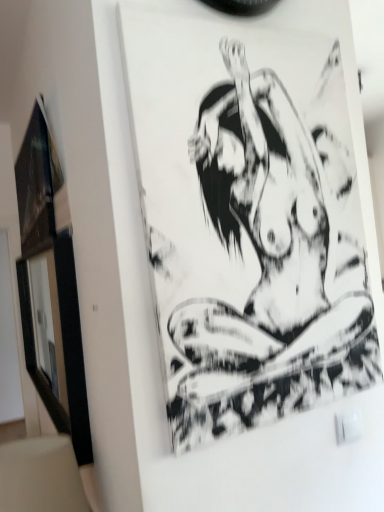
In order to click on black ink drawing at center in this screenshot , I will do `click(266, 220)`.

This screenshot has width=384, height=512. What do you see at coordinates (266, 220) in the screenshot?
I see `black ink drawing at center` at bounding box center [266, 220].

Describe the element at coordinates (37, 183) in the screenshot. I see `matte black picture frame at left` at that location.

You are a GUI agent. You are given a task and a screenshot of the screen. Output one action in this format:
    pyautogui.click(x=<x>, y=<y>)
    Task: Click on the matte black picture frame at left
    This screenshot has width=384, height=512.
    Given the screenshot: What is the action you would take?
    pyautogui.click(x=37, y=183)

I want to click on black ink drawing at center, so click(266, 220).

Does matte black picture frame at left appear on the right side of black ink drawing at center?

In fact, matte black picture frame at left is to the left of black ink drawing at center.

From the picture: Considering the positions of objects matte black picture frame at left and black ink drawing at center in the image provided, who is behind, matte black picture frame at left or black ink drawing at center?

matte black picture frame at left is behind.

Is point (33, 146) positioned in front of point (304, 298)?

No, (33, 146) is further to viewer.

From the image's perspective, is matte black picture frame at left on top of black ink drawing at center?

Yes, from the image's perspective, matte black picture frame at left is over black ink drawing at center.

From a real-world perspective, who is located lower, matte black picture frame at left or black ink drawing at center?

black ink drawing at center.

Between matte black picture frame at left and black ink drawing at center, which one has smaller width?

With smaller width is black ink drawing at center.

Considering the sizes of objects matte black picture frame at left and black ink drawing at center in the image provided, who is taller, matte black picture frame at left or black ink drawing at center?

With more height is black ink drawing at center.

Does matte black picture frame at left have a larger size compared to black ink drawing at center?

Yes.

Can black ink drawing at center be found inside matte black picture frame at left?

Actually, black ink drawing at center is outside matte black picture frame at left.

Consider the image. Is the surface of matte black picture frame at left in direct contact with black ink drawing at center?

matte black picture frame at left and black ink drawing at center are not in contact.

Is matte black picture frame at left facing away from black ink drawing at center?

That's not correct — matte black picture frame at left is not looking away from black ink drawing at center.

How different are the orientations of matte black picture frame at left and black ink drawing at center in degrees?

90.9 degrees.

Measure the distance from matte black picture frame at left to black ink drawing at center.

The distance of matte black picture frame at left from black ink drawing at center is 76.48 centimeters.

Identify the location of picture frame lying above the black ink drawing at center (from the image's perspective). Image resolution: width=384 pixels, height=512 pixels. (37, 183).

Can you confirm if black ink drawing at center is positioned to the left of matte black picture frame at left?

In fact, black ink drawing at center is to the right of matte black picture frame at left.

Is black ink drawing at center positioned before matte black picture frame at left?

Yes, it is.

Considering the points (293, 242) and (39, 195), which point is in front, point (293, 242) or point (39, 195)?

The point (293, 242) is more forward.

From the image's perspective, which one is positioned lower, black ink drawing at center or matte black picture frame at left?

black ink drawing at center.

From a real-world perspective, is black ink drawing at center beneath matte black picture frame at left?

Correct, in the physical world, black ink drawing at center is lower than matte black picture frame at left.

Which of these two, black ink drawing at center or matte black picture frame at left, is thinner?

black ink drawing at center is thinner.

Is black ink drawing at center shorter than matte black picture frame at left?

No, black ink drawing at center is not shorter than matte black picture frame at left.

Who is bigger, black ink drawing at center or matte black picture frame at left?

matte black picture frame at left is bigger.

Which is correct: black ink drawing at center is inside matte black picture frame at left, or outside of it?

black ink drawing at center is spatially situated outside matte black picture frame at left.

Can you see black ink drawing at center touching matte black picture frame at left?

No, black ink drawing at center is not beside matte black picture frame at left.

Is black ink drawing at center positioned with its back to matte black picture frame at left?

Yes, black ink drawing at center is positioned with its back facing matte black picture frame at left.

What's the angular difference between black ink drawing at center and matte black picture frame at left's facing directions?

They differ by 90.9 degrees in their facing directions.

In order to click on picture frame above the black ink drawing at center (from the image's perspective) in this screenshot , I will do `click(37, 183)`.

This screenshot has width=384, height=512. Identify the location of person lying in front of the matte black picture frame at left. (266, 220).

I want to click on person below the matte black picture frame at left (from a real-world perspective), so click(x=266, y=220).